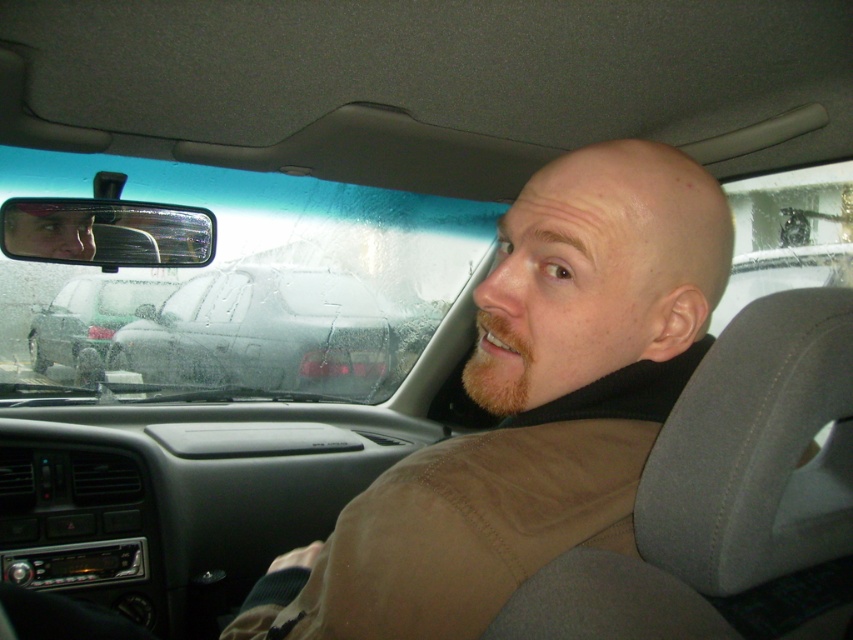
Can you confirm if brown cotton shirt at center is positioned to the left of wet glass windshield at center?

Incorrect, brown cotton shirt at center is not on the left side of wet glass windshield at center.

Measure the distance between point (526,561) and camera.

Point (526,561) is 25.04 inches from camera.

Locate an element on the screen. Image resolution: width=853 pixels, height=640 pixels. brown cotton shirt at center is located at coordinates (529, 406).

Does point (233, 360) come in front of point (97, 308)?

No, (233, 360) is further to viewer.

Who is positioned more to the right, wet glass windshield at center or satin black sedan at rear?

wet glass windshield at center

At what (x,y) coordinates should I click in order to perform the action: click on wet glass windshield at center. Please return your answer as a coordinate pair (x, y). Looking at the image, I should click on (219, 280).

Between wet glass windshield at center and smokey gray car at center, which one appears on the left side from the viewer's perspective?

smokey gray car at center is more to the left.

Between point (349, 308) and point (262, 365), which one is positioned in front?

Point (262, 365) is in front.

Who is more forward, (0,157) or (277,282)?

Point (0,157)

I want to click on wet glass windshield at center, so click(x=219, y=280).